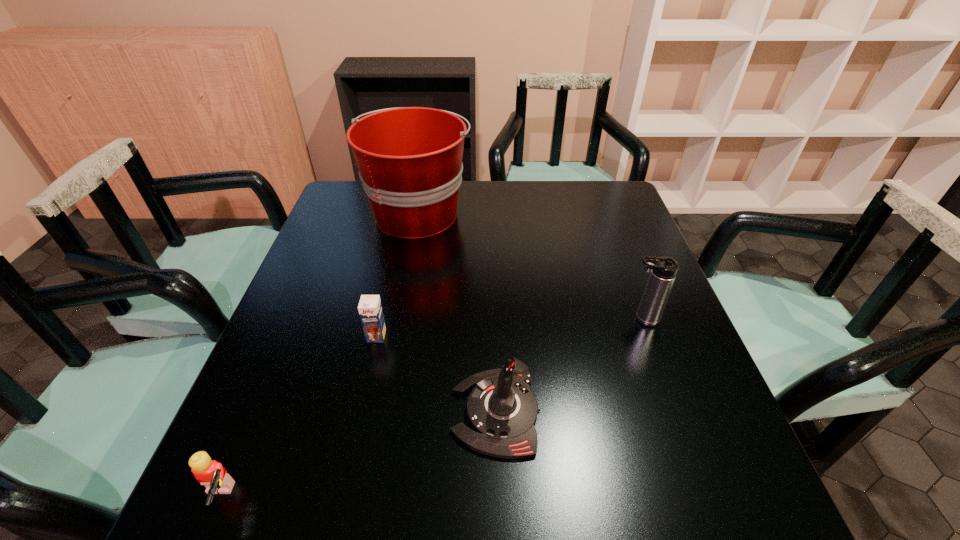
The image size is (960, 540). What are the coordinates of `object that is the fourth closest to the chocolate milk` in the screenshot? It's located at (663, 269).

Locate which object is the closest to the third nearest object. Please provide its 2D coordinates. Your answer should be formatted as a tuple, i.e. [(x, y)], where the tuple contains the x and y coordinates of a point satisfying the conditions above.

[(502, 410)]

You are a GUI agent. You are given a task and a screenshot of the screen. Output one action in this format:
    pyautogui.click(x=<x>, y=<y>)
    Task: Click on the vacant space that satisfies the following two spatial constraints: 1. on the handle side of the rightmost object; 2. on the front label of the third farthest object
    The height and width of the screenshot is (540, 960).
    Given the screenshot: What is the action you would take?
    pyautogui.click(x=648, y=336)